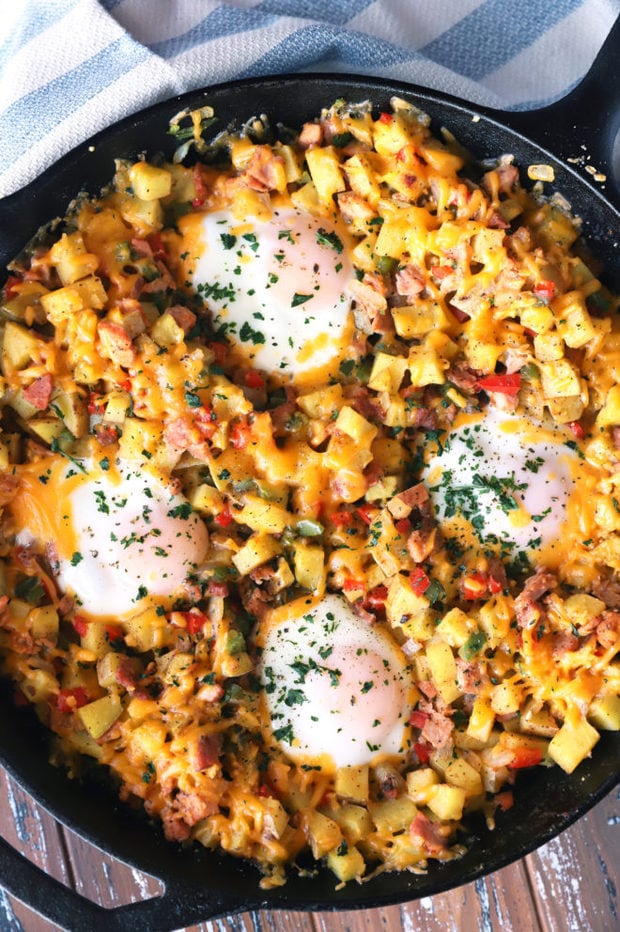
Identify the location of pot handle. Image resolution: width=620 pixels, height=932 pixels. (18, 867), (587, 133).